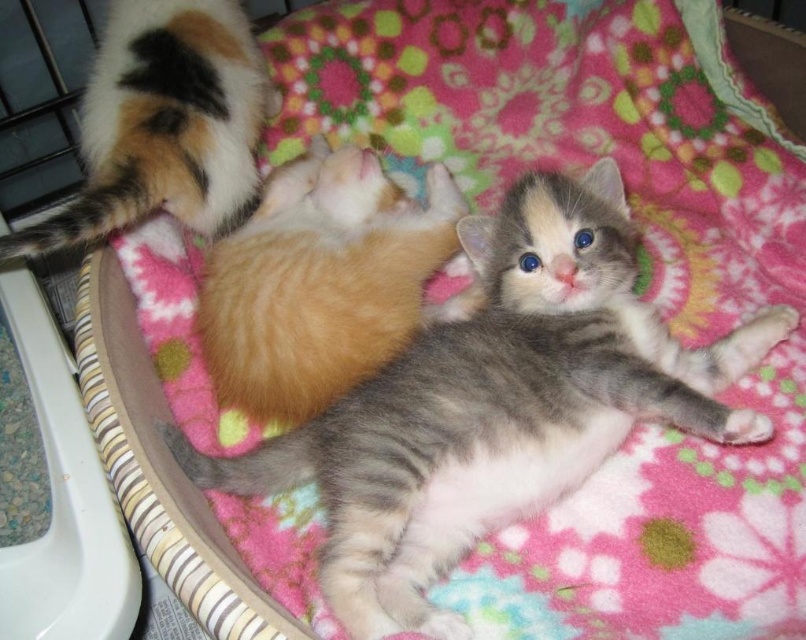
Question: Which of the following is the farthest from the observer?

Choices:
 (A) (144, 116)
 (B) (323, 371)

Answer: (A)

Question: Is orange fur cat at center further to the viewer compared to calico fur tail at upper left?

Choices:
 (A) no
 (B) yes

Answer: (B)

Question: Does fluffy gray kitten at center lie behind calico fur tail at upper left?

Choices:
 (A) yes
 (B) no

Answer: (B)

Question: Which point is closer to the camera?

Choices:
 (A) (x=214, y=304)
 (B) (x=345, y=420)

Answer: (B)

Question: Does fluffy gray kitten at center appear on the right side of orange fur cat at center?

Choices:
 (A) yes
 (B) no

Answer: (A)

Question: Which is farther from the calico fur tail at upper left?

Choices:
 (A) orange fur cat at center
 (B) fluffy gray kitten at center

Answer: (B)